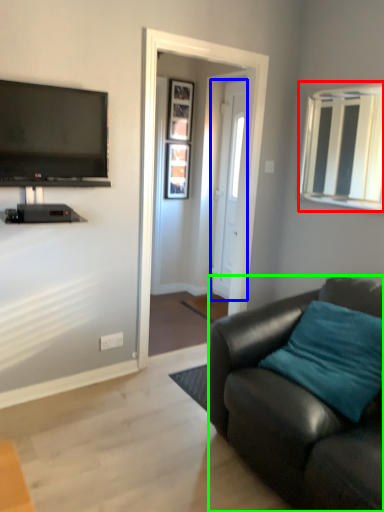
Question: Which is farther away from window (highlighted by a red box)? door (highlighted by a blue box) or studio couch (highlighted by a green box)?

Choices:
 (A) door
 (B) studio couch

Answer: (B)